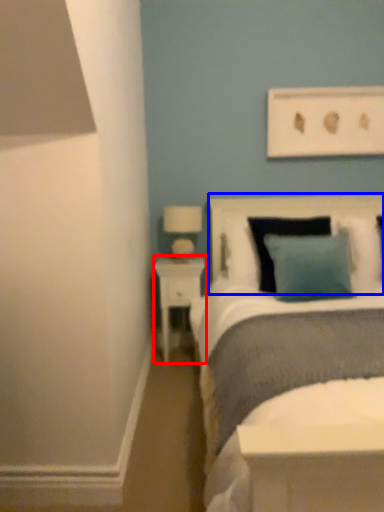
Question: Which object appears farthest to the camera in this image, nightstand (highlighted by a red box) or headboard (highlighted by a blue box)?

Choices:
 (A) nightstand
 (B) headboard

Answer: (A)